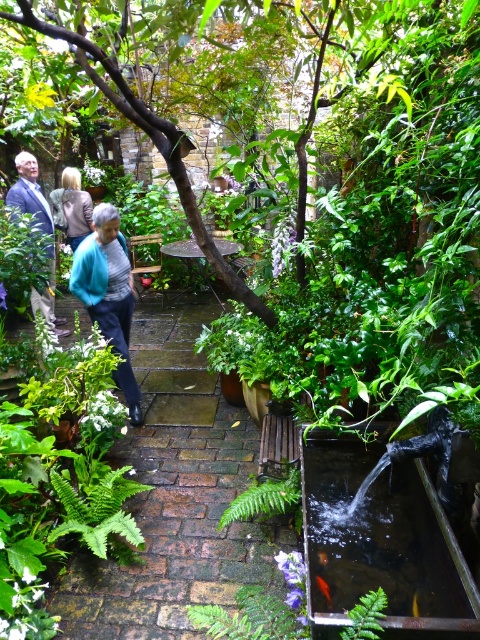
You are a gardener standing at the edge of the garden. You see a green leafy path at center and a teal sweater at center. Which object is closer to the ground?

The green leafy path at center is closer to the ground because it is below the teal sweater at center.

Which fern is wider, the green leafy fern at lower left or the green leafy fern at center?

The green leafy fern at lower left might be wider than the green leafy fern at center according to the description.